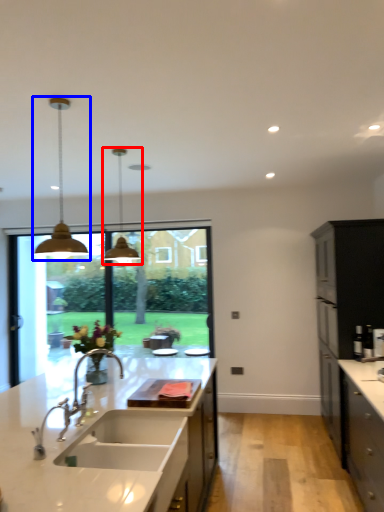
Question: Which object is closer to the camera taking this photo, light fixture (highlighted by a red box) or lamp (highlighted by a blue box)?

Choices:
 (A) light fixture
 (B) lamp

Answer: (B)